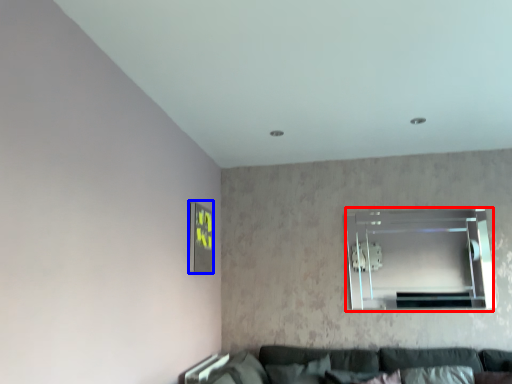
Question: Among these objects, which one is farthest to the camera, window (highlighted by a red box) or picture frame (highlighted by a blue box)?

Choices:
 (A) window
 (B) picture frame

Answer: (A)